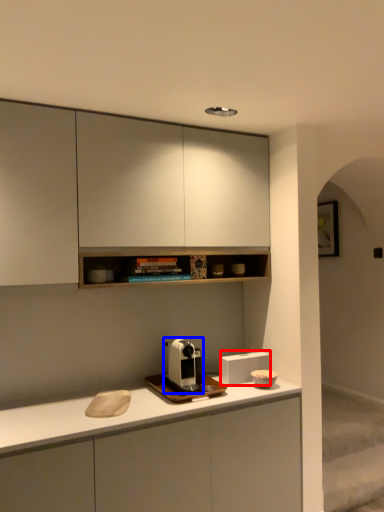
Question: Which of the following is the farthest to the observer, appliance (highlighted by a red box) or coffee machine (highlighted by a blue box)?

Choices:
 (A) appliance
 (B) coffee machine

Answer: (A)